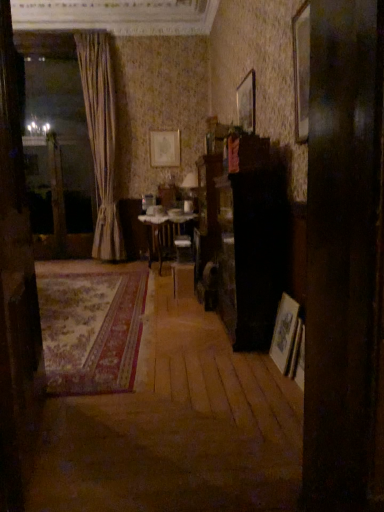
You are a GUI agent. You are given a task and a screenshot of the screen. Output one action in this format:
    pyautogui.click(x=<x>, y=<y>)
    Task: Click on the vacant space behind wooden door at left
    The image size is (384, 512).
    Given the screenshot: What is the action you would take?
    pyautogui.click(x=109, y=367)